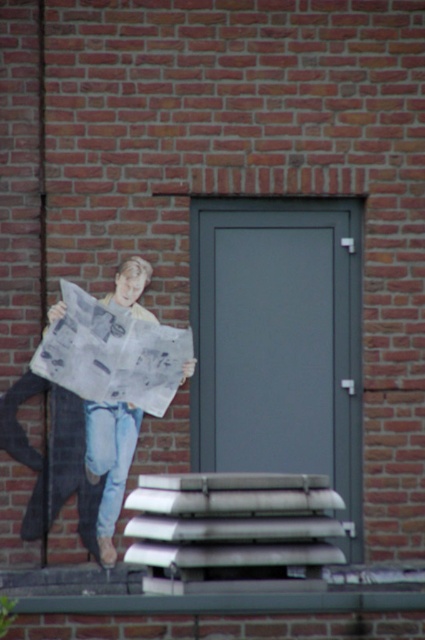
Does point (129, 429) lie behind point (105, 452)?

Yes, point (129, 429) is farther from viewer.

Which is in front, point (102, 467) or point (96, 451)?

Point (102, 467) is in front.

Which is in front, point (93, 417) or point (110, 444)?

Point (93, 417) is in front.

The width and height of the screenshot is (425, 640). Identify the location of matte newspaper at left. (110, 464).

Who is more distant from viewer, (37,362) or (104,545)?

The point (104,545) is more distant.

Does white printed newspaper at left appear over matte newspaper at left?

Indeed, white printed newspaper at left is positioned over matte newspaper at left.

What are the coordinates of `white printed newspaper at left` in the screenshot? It's located at (112, 353).

You are a GUI agent. You are given a task and a screenshot of the screen. Output one action in this format:
    pyautogui.click(x=<x>, y=<y>)
    Task: Click on the white printed newspaper at left
    The height and width of the screenshot is (640, 425).
    Given the screenshot: What is the action you would take?
    pyautogui.click(x=112, y=353)

Which of these two, white printed newspaper at left or denim at left, stands taller?

With more height is white printed newspaper at left.

Where is `white printed newspaper at left`? white printed newspaper at left is located at coordinates (112, 353).

This screenshot has height=640, width=425. Find the location of `white printed newspaper at left`. white printed newspaper at left is located at coordinates (112, 353).